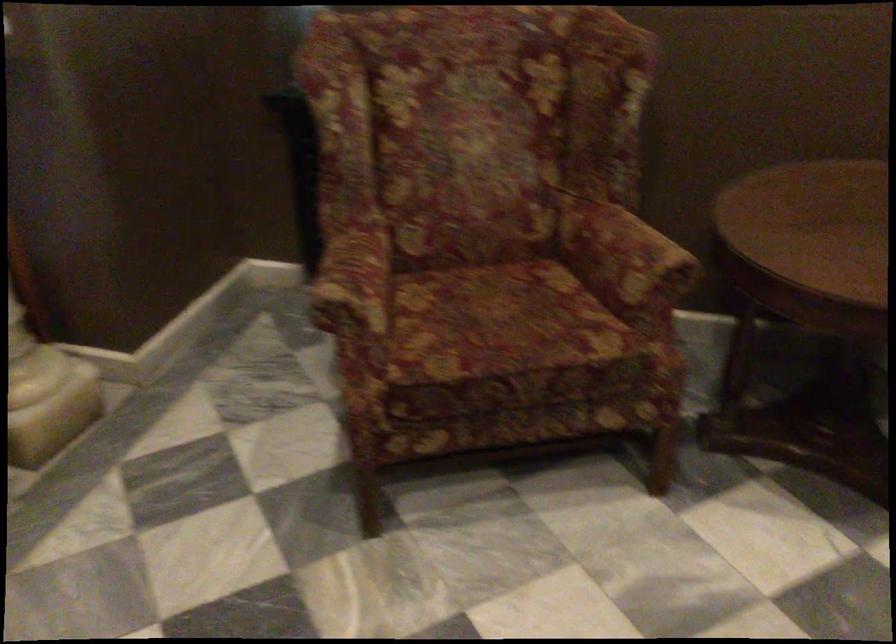
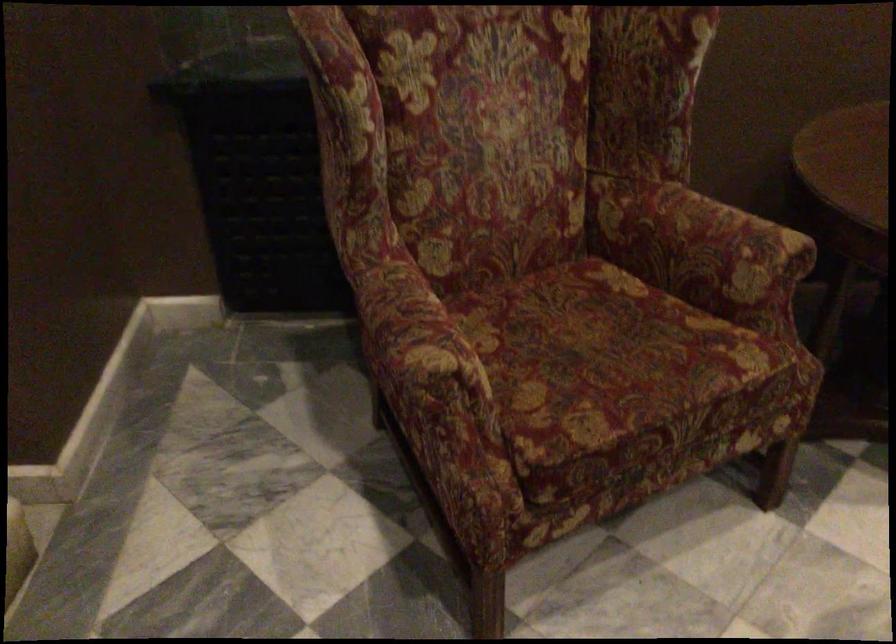
Find the pixel in the second image that matches [615,252] in the first image.

(700, 243)